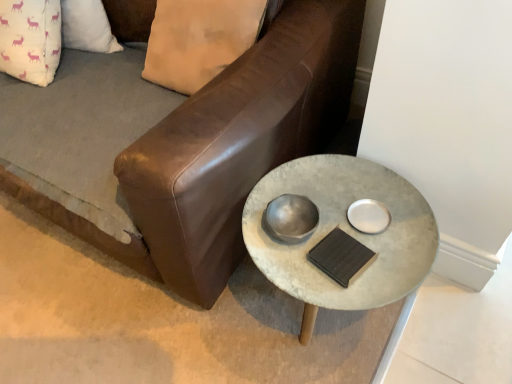
Question: Is point (398, 289) closer or farther from the camera than point (224, 137)?

Choices:
 (A) closer
 (B) farther

Answer: (B)

Question: Looking at their shapes, would you say concrete textured table at center is wider or thinner than brown leather couch at center?

Choices:
 (A) thin
 (B) wide

Answer: (A)

Question: Looking at the image, does concrete textured table at center seem bigger or smaller compared to brown leather couch at center?

Choices:
 (A) small
 (B) big

Answer: (A)

Question: From the image's perspective, relative to concrete textured table at center, is brown leather couch at center above or below?

Choices:
 (A) above
 (B) below

Answer: (A)

Question: From a real-world perspective, relative to concrete textured table at center, is brown leather couch at center vertically above or below?

Choices:
 (A) above
 (B) below

Answer: (B)

Question: Based on their sizes in the image, would you say brown leather couch at center is bigger or smaller than concrete textured table at center?

Choices:
 (A) small
 (B) big

Answer: (B)

Question: Does point (211, 162) appear closer or farther from the camera than point (275, 253)?

Choices:
 (A) closer
 (B) farther

Answer: (A)